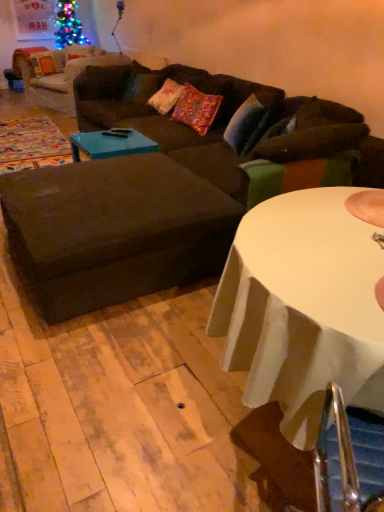
What is the approximate height of blue glossy coffee table at center?

blue glossy coffee table at center is 10.49 inches tall.

Consider the image. Measure the distance between point [361,120] and camera.

Point [361,120] and camera are 9.06 feet apart.

Image resolution: width=384 pixels, height=512 pixels. What do you see at coordinates (238, 131) in the screenshot?
I see `dark brown fabric couch at center` at bounding box center [238, 131].

Consider the image. In order to face brown fabric ottoman at center, should I rotate leftwards or rightwards?

You should rotate left by 10.846 degrees.

In order to face floral fabric pillow at center, should I rotate leftwards or rightwards?

Rotate right and turn 0.169 degrees.

Identify the location of blue glossy coffee table at center. (111, 144).

At what (x,y) coordinates should I click in order to perform the action: click on studio couch located above the brown fabric ottoman at center (from a real-world perspective). Please return your answer as a coordinate pair (x, y). The image size is (384, 512). Looking at the image, I should click on (167, 190).

From the picture: From a real-world perspective, which object rests below the other?

In real-world perspective, brown fabric ottoman at center is lower.

From the image's perspective, between brown fabric ottoman at center and dark brown fabric couch at center, who is located below?

From the image's view, brown fabric ottoman at center is below.

Could you tell me if brown fabric ottoman at center is turned towards dark brown fabric couch at center?

Yes, brown fabric ottoman at center is aimed at dark brown fabric couch at center.

Between white glossy table at center and dark brown fabric couch at center, which one is positioned behind?

dark brown fabric couch at center is behind.

Is white glossy table at center far from dark brown fabric couch at center?

Indeed, white glossy table at center is not near dark brown fabric couch at center.

Between white glossy table at center and dark brown fabric couch at center, which one has larger size?

With larger size is dark brown fabric couch at center.

From a real-world perspective, which object rests below the other?

From a 3D spatial view, dark brown fabric couch at center is below.

Considering the sizes of objects dark brown fabric couch at center and dark brown fabric couch at center in the image provided, who is shorter, dark brown fabric couch at center or dark brown fabric couch at center?

dark brown fabric couch at center.

Measure the distance from dark brown fabric couch at center to dark brown fabric couch at center.

The distance of dark brown fabric couch at center from dark brown fabric couch at center is 9.18 inches.

Is dark brown fabric couch at center not within dark brown fabric couch at center?

Actually, dark brown fabric couch at center is within dark brown fabric couch at center.

Which object is positioned more to the right, brown fabric ottoman at center or white glossy table at center?

white glossy table at center.

Can you confirm if brown fabric ottoman at center is thinner than white glossy table at center?

No.

Does brown fabric ottoman at center have a larger size compared to white glossy table at center?

No.

Is brown fabric ottoman at center beside white glossy table at center?

They are not placed beside each other.

Which is less distant, (290,284) or (212,116)?

Point (290,284) is positioned closer to the camera compared to point (212,116).

Is white glossy table at center outside of floral fabric pillow at center?

white glossy table at center lies outside floral fabric pillow at center's area.

Does white glossy table at center lie behind floral fabric pillow at center?

No, the depth of white glossy table at center is less than that of floral fabric pillow at center.

Does brown fabric ottoman at center appear on the left side of blue glossy coffee table at center?

No, brown fabric ottoman at center is not to the left of blue glossy coffee table at center.

From a real-world perspective, is brown fabric ottoman at center physically above blue glossy coffee table at center?

Incorrect, from a real-world perspective, brown fabric ottoman at center is lower than blue glossy coffee table at center.

Is brown fabric ottoman at center behind blue glossy coffee table at center?

No, the depth of brown fabric ottoman at center is less than that of blue glossy coffee table at center.

From the image's perspective, is brown fabric ottoman at center above or below blue glossy coffee table at center?

From the image's perspective, brown fabric ottoman at center appears below blue glossy coffee table at center.

Can you confirm if brown fabric ottoman at center is positioned to the left of floral fabric pillow at center?

Correct, you'll find brown fabric ottoman at center to the left of floral fabric pillow at center.

Between brown fabric ottoman at center and floral fabric pillow at center, which one is positioned in front?

Positioned in front is brown fabric ottoman at center.

From a real-world perspective, is brown fabric ottoman at center physically below floral fabric pillow at center?

Yes, from a real-world perspective, brown fabric ottoman at center is under floral fabric pillow at center.

From the picture: What's the angular difference between brown fabric ottoman at center and floral fabric pillow at center's facing directions?

The facing directions of brown fabric ottoman at center and floral fabric pillow at center are 3.31 degrees apart.

This screenshot has height=512, width=384. Identify the location of studio couch on the right side of brown fabric ottoman at center. (167, 190).

Locate an element on the screen. Image resolution: width=384 pixels, height=512 pixels. table below the dark brown fabric couch at center (from the image's perspective) is located at coordinates (303, 308).

Based on their spatial positions, is floral fabric pillow at center or brown fabric ottoman at center further from dark brown fabric couch at center?

brown fabric ottoman at center lies further to dark brown fabric couch at center than the other object.

Looking at the image, which one is located closer to dark brown fabric couch at center, dark brown fabric couch at center or blue glossy coffee table at center?

dark brown fabric couch at center lies closer to dark brown fabric couch at center than the other object.

Considering their positions, is blue glossy coffee table at center positioned closer to brown fabric ottoman at center than dark brown fabric couch at center?

Among the two, dark brown fabric couch at center is located nearer to brown fabric ottoman at center.

Estimate the real-world distances between objects in this image. Which object is closer to blue glossy coffee table at center, dark brown fabric couch at center or white glossy table at center?

dark brown fabric couch at center is closer to blue glossy coffee table at center.

Based on their spatial positions, is dark brown fabric couch at center or blue glossy coffee table at center further from floral fabric pillow at center?

dark brown fabric couch at center is positioned further to the anchor floral fabric pillow at center.

Considering their positions, is blue glossy coffee table at center positioned closer to floral fabric pillow at center than white glossy table at center?

blue glossy coffee table at center is closer to floral fabric pillow at center.

Which object lies further to the anchor point floral fabric pillow at center, white glossy table at center or dark brown fabric couch at center?

white glossy table at center.

Based on the photo, considering their positions, is floral fabric pillow at center positioned closer to brown fabric ottoman at center than blue glossy coffee table at center?

blue glossy coffee table at center is positioned closer to the anchor brown fabric ottoman at center.

You are a GUI agent. You are given a task and a screenshot of the screen. Output one action in this format:
    pyautogui.click(x=<x>, y=<y>)
    Task: Click on the couch between brown fabric ottoman at center and blue glossy coffee table at center along the z-axis
    The height and width of the screenshot is (512, 384).
    Given the screenshot: What is the action you would take?
    pyautogui.click(x=238, y=131)

At what (x,y) coordinates should I click in order to perform the action: click on wide between dark brown fabric couch at center and white glossy table at center in the up-down direction. Please return your answer as a coordinate pair (x, y). Image resolution: width=384 pixels, height=512 pixels. Looking at the image, I should click on (114, 230).

This screenshot has height=512, width=384. Identify the location of studio couch between dark brown fabric couch at center and brown fabric ottoman at center in the up-down direction. (167, 190).

This screenshot has height=512, width=384. In order to click on coffee table between dark brown fabric couch at center and floral fabric pillow at center from front to back in this screenshot , I will do `click(111, 144)`.